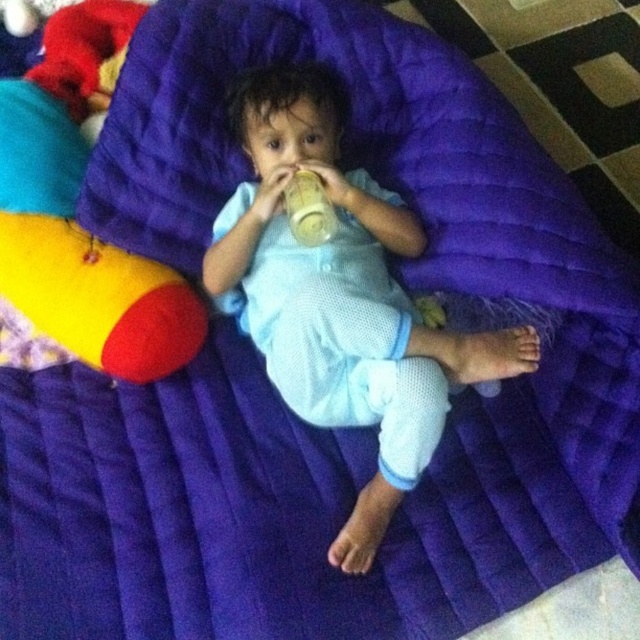
Question: Does light blue fabric toddler at center have a greater width compared to translucent plastic bottle at center?

Choices:
 (A) no
 (B) yes

Answer: (B)

Question: Is light blue fabric toddler at center smaller than translucent plastic bottle at center?

Choices:
 (A) no
 (B) yes

Answer: (A)

Question: Is light blue fabric toddler at center to the left of translucent plastic bottle at center from the viewer's perspective?

Choices:
 (A) yes
 (B) no

Answer: (B)

Question: Which point is farther from the camera taking this photo?

Choices:
 (A) (316, 212)
 (B) (381, 451)

Answer: (A)